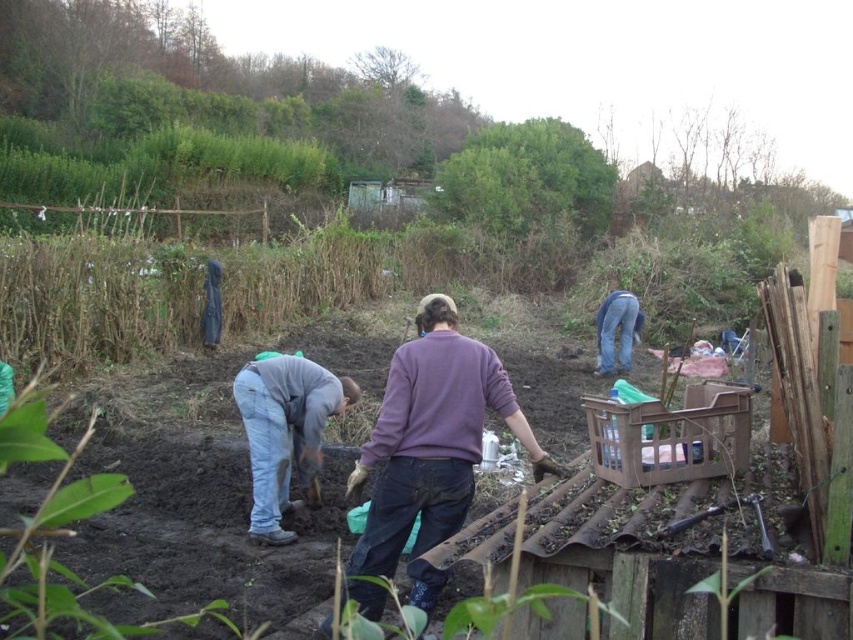
You are a gardener who needs to retrieve a tool from the plastic crate on the raised garden bed. You see the purple sweater at center and the denim jeans at right. Which item is located to the left of the other?

The purple sweater at center is positioned on the left side of denim jeans at right, so the purple sweater at center is to the left of the denim jeans at right.

You are standing in the garden and want to reach both the point at coordinates (264, 534) and the point at (641, 317). Which point will you reach first?

You will reach the point at coordinates (264, 534) first because it is closer to you than the point at (641, 317).

You are standing in the garden and want to reach both the point at coordinates point (396,547) and the point at coordinates point (613,298). Which point will you reach first if you move directly towards them?

You will reach point (396,547) first because it is closer to you than point (613,298).